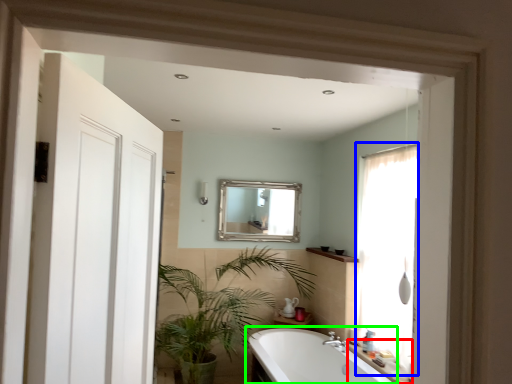
Question: Which is farther away from counter top (highlighted by a red box)? window (highlighted by a blue box) or bathtub (highlighted by a green box)?

Choices:
 (A) window
 (B) bathtub

Answer: (A)